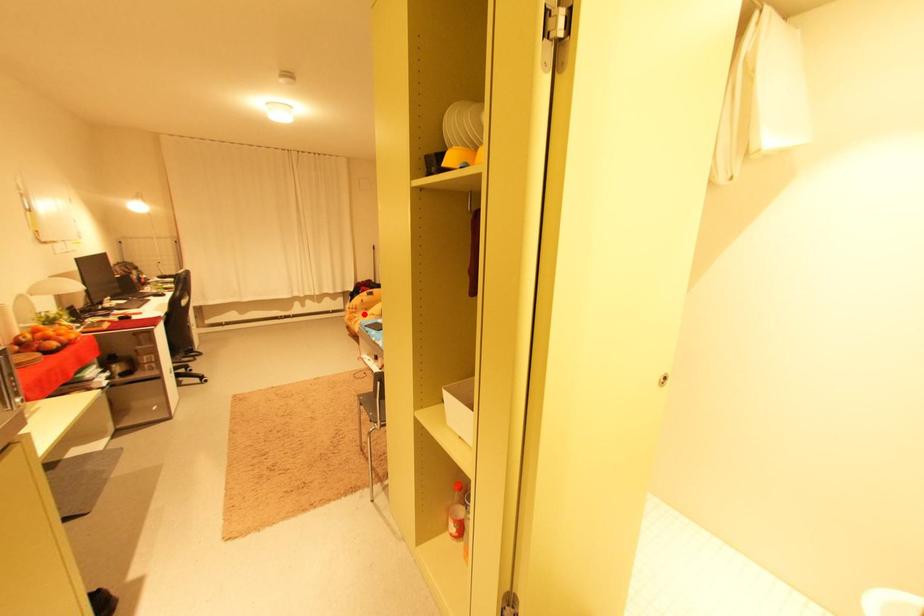
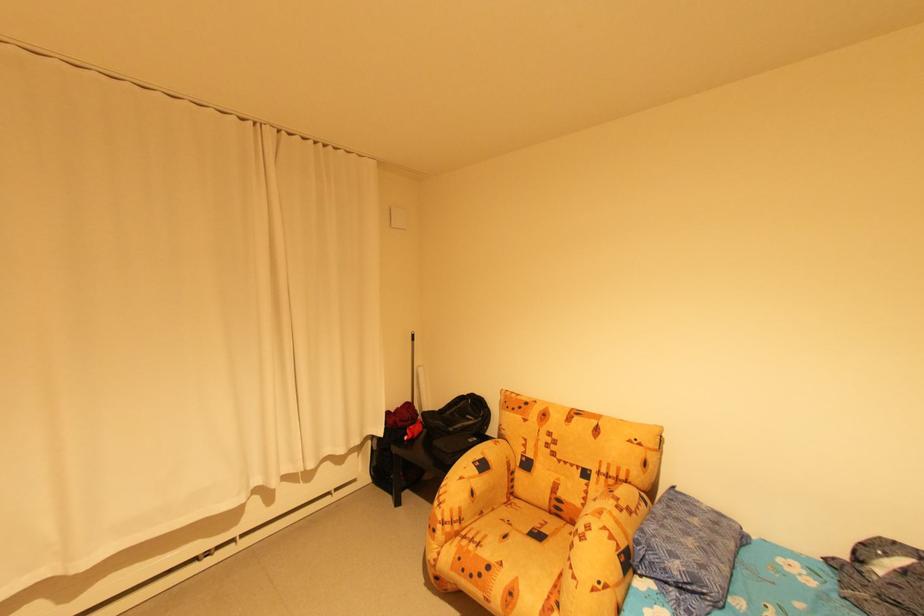
Locate, in the second image, the point that corresponds to the highlighted location in the first image.

(485, 545)